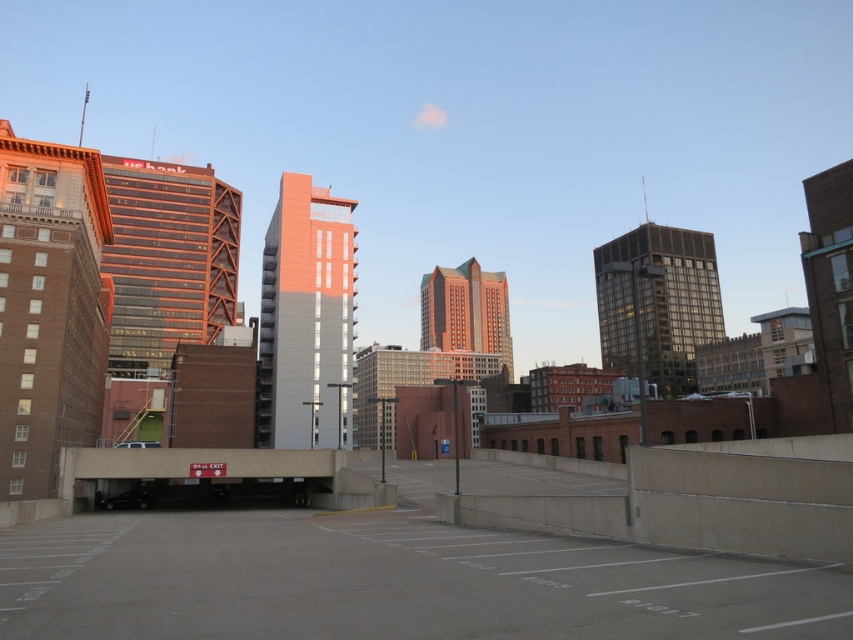
Question: Among these points, which one is farthest from the camera?

Choices:
 (A) (543, 577)
 (B) (126, 499)

Answer: (B)

Question: Does gray concrete parking lot at center appear under shiny black sedan at lower left?

Choices:
 (A) yes
 (B) no

Answer: (B)

Question: Is gray concrete parking lot at center to the left of shiny black sedan at lower left from the viewer's perspective?

Choices:
 (A) yes
 (B) no

Answer: (B)

Question: Is gray concrete parking lot at center positioned in front of shiny black sedan at lower left?

Choices:
 (A) yes
 (B) no

Answer: (A)

Question: Which point is farther to the camera?

Choices:
 (A) (648, 604)
 (B) (106, 502)

Answer: (B)